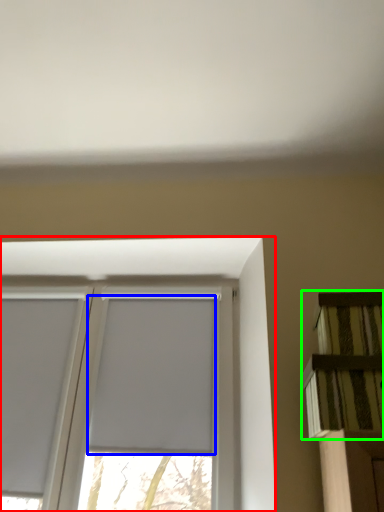
Question: Which is nearer to the window (highlighted by a red box)? window screen (highlighted by a blue box) or shelf (highlighted by a green box).

Choices:
 (A) window screen
 (B) shelf

Answer: (A)